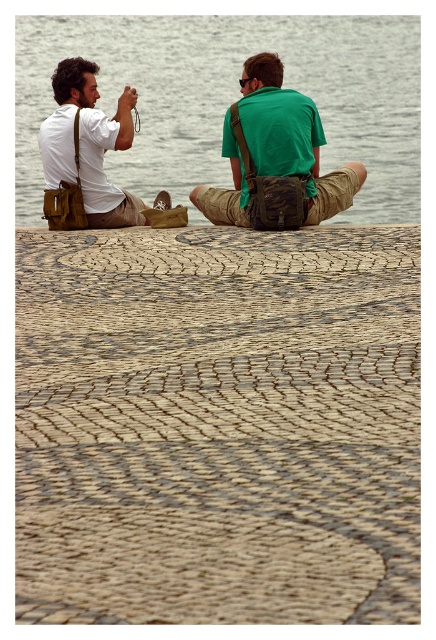
Question: Can you confirm if gray water at center is smaller than khaki fabric bag at center?

Choices:
 (A) no
 (B) yes

Answer: (A)

Question: Which point is farther from the camera taking this photo?

Choices:
 (A) (406, 76)
 (B) (265, 202)

Answer: (A)

Question: Which object appears farthest from the camera in this image?

Choices:
 (A) matte brown bag at left
 (B) gray water at center
 (C) khaki fabric bag at center

Answer: (B)

Question: Can you confirm if khaki fabric bag at center is positioned above matte brown bag at left?

Choices:
 (A) yes
 (B) no

Answer: (A)

Question: Which point appears closest to the camera in this image?

Choices:
 (A) (77, 161)
 (B) (214, 72)
 (C) (285, 93)

Answer: (A)

Question: Does khaki fabric bag at center have a smaller size compared to matte brown bag at left?

Choices:
 (A) yes
 (B) no

Answer: (A)